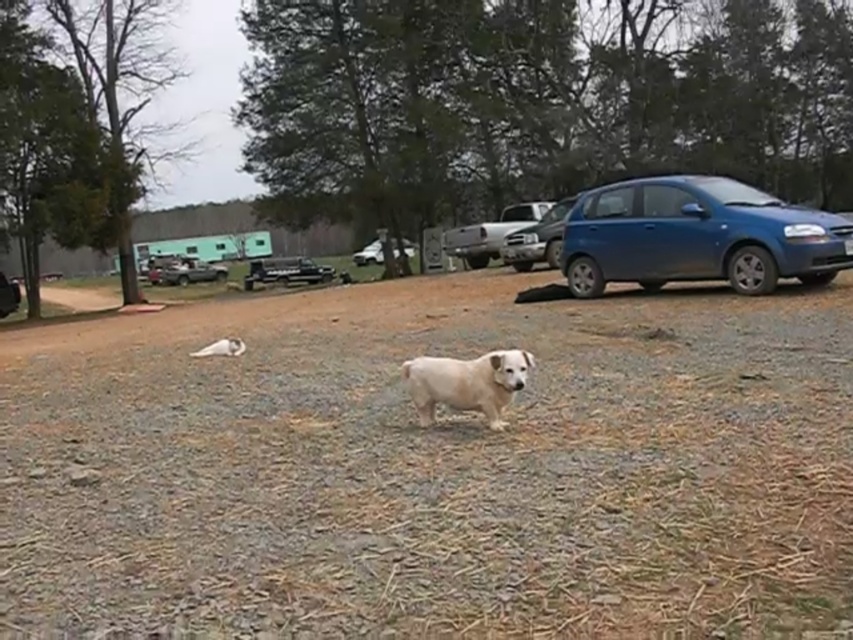
You are driving a car and want to exit the campground. You see the black matte truck at center and the white matte car at center. Which vehicle is blocking your path?

The black matte truck at center is blocking your path because the white matte car at center is behind it, meaning the black matte truck is in front.

You are a photographer setting up a tripod in the center of the campground scene. You need to position your camera so that both the metallic silver truck at center and the white matte car at center are fully visible in the frame. Since you can only adjust the height of the tripod, which vehicle should you focus on to ensure both are in view without cropping either?

The metallic silver truck at center is shorter than the white matte car at center. To ensure both are fully visible, you should adjust the tripod height based on the metallic silver truck at center, as it requires a lower camera angle to capture its full height without cropping the taller white matte car at center.